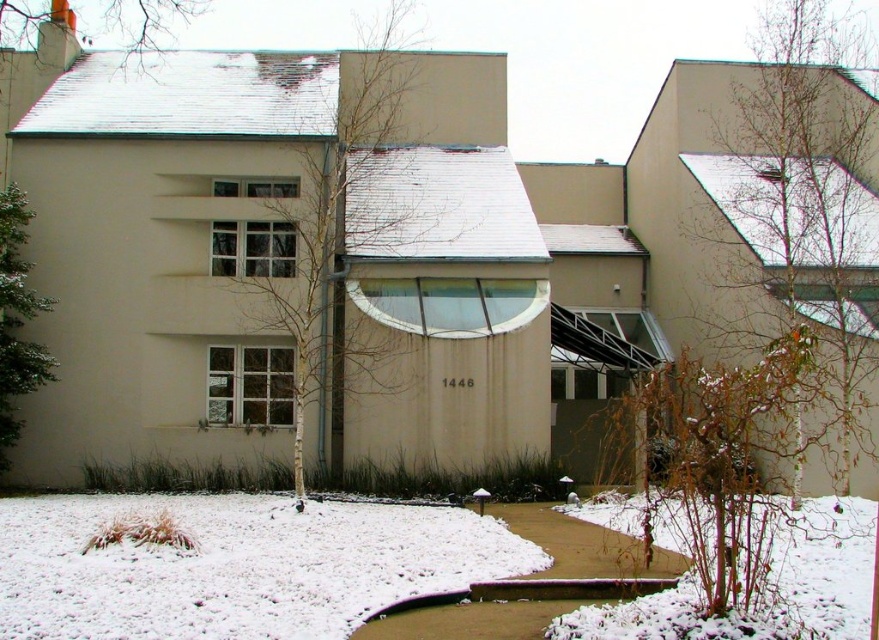
You are a delivery person trying to park your van in front of the building. The van requires a space wider than the green textured evergreen tree at left. Can you park here based on the white powdery snow at lower center?

The white powdery snow at lower center is wider than the green textured evergreen tree at left, so yes, the parking space is wide enough for the van.

You are a landscape architect evaluating the winter scene of a modern building. You notice the bare branches at center and the green textured evergreen tree at left. Which of these two objects is larger in size?

The bare branches at center is bigger than the green textured evergreen tree at left according to the description provided.

You are standing in front of the modern building and notice the bare branches at center. Can you determine their exact position relative to the building using the coordinate system provided?

The bare branches at center are located at the coordinate point specified as 0.338 along the x and 0.399 along the y axis.